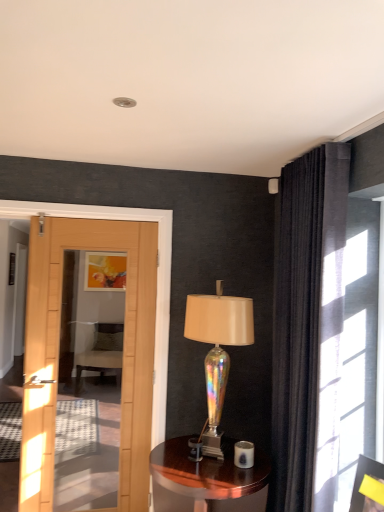
Question: Is dark velvet curtain at upper right not near yellow paper at upper right, acting as the first picture frame starting from the right?

Choices:
 (A) no
 (B) yes

Answer: (A)

Question: Is dark velvet curtain at upper right at the left side of yellow paper at upper right, acting as the first picture frame starting from the right?

Choices:
 (A) yes
 (B) no

Answer: (A)

Question: From a real-world perspective, is dark velvet curtain at upper right located beneath yellow paper at upper right, acting as the first picture frame starting from the front?

Choices:
 (A) yes
 (B) no

Answer: (B)

Question: Would you say yellow paper at upper right, acting as the first picture frame starting from the bottom, is part of dark velvet curtain at upper right's contents?

Choices:
 (A) yes
 (B) no

Answer: (B)

Question: Is dark velvet curtain at upper right bigger than yellow paper at upper right, acting as the first picture frame starting from the right?

Choices:
 (A) yes
 (B) no

Answer: (A)

Question: Does point (102, 344) appear closer or farther from the camera than point (312, 225)?

Choices:
 (A) farther
 (B) closer

Answer: (A)

Question: From the image's perspective, relative to dark velvet curtain at upper right, is velvet green chair at center above or below?

Choices:
 (A) below
 (B) above

Answer: (A)

Question: Based on their sizes in the image, would you say velvet green chair at center is bigger or smaller than dark velvet curtain at upper right?

Choices:
 (A) big
 (B) small

Answer: (A)

Question: From a real-world perspective, relative to dark velvet curtain at upper right, is velvet green chair at center vertically above or below?

Choices:
 (A) below
 (B) above

Answer: (A)

Question: Looking at their shapes, would you say velvet green chair at center is wider or thinner than iridescent glass lamp at center?

Choices:
 (A) thin
 (B) wide

Answer: (B)

Question: In terms of height, does velvet green chair at center look taller or shorter compared to iridescent glass lamp at center?

Choices:
 (A) short
 (B) tall

Answer: (A)

Question: Looking at the image, does velvet green chair at center seem bigger or smaller compared to iridescent glass lamp at center?

Choices:
 (A) big
 (B) small

Answer: (A)

Question: In the image, is velvet green chair at center on the left side or the right side of iridescent glass lamp at center?

Choices:
 (A) left
 (B) right

Answer: (A)

Question: Considering the positions of yellow paper at upper right, acting as the first picture frame starting from the right, and iridescent glass lamp at center in the image, is yellow paper at upper right, acting as the first picture frame starting from the right, wider or thinner than iridescent glass lamp at center?

Choices:
 (A) thin
 (B) wide

Answer: (A)

Question: Based on their sizes in the image, would you say yellow paper at upper right, acting as the first picture frame starting from the right, is bigger or smaller than iridescent glass lamp at center?

Choices:
 (A) big
 (B) small

Answer: (B)